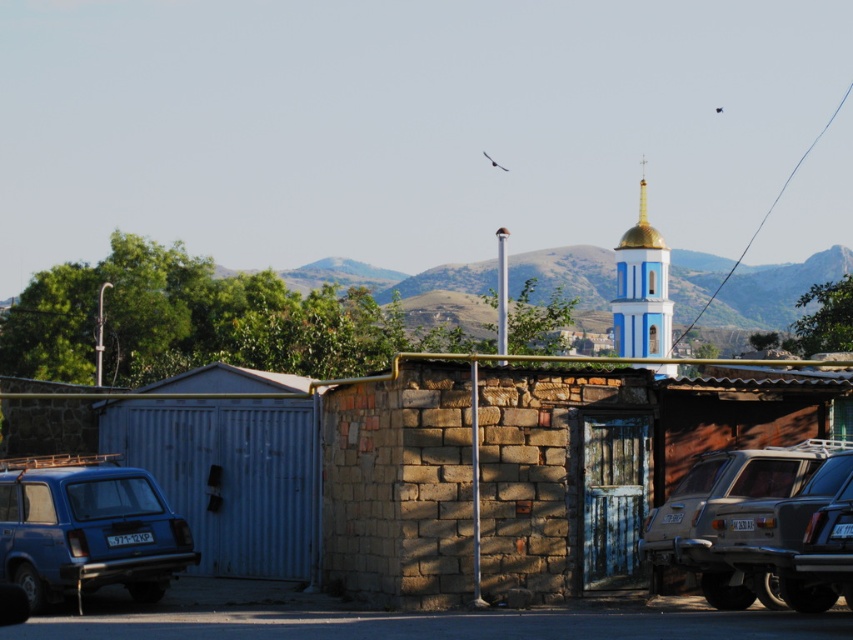
Is metallic blue shed at left to the left of matte blue suv at lower left from the viewer's perspective?

In fact, metallic blue shed at left is to the right of matte blue suv at lower left.

You are a GUI agent. You are given a task and a screenshot of the screen. Output one action in this format:
    pyautogui.click(x=<x>, y=<y>)
    Task: Click on the metallic blue shed at left
    This screenshot has height=640, width=853.
    Given the screenshot: What is the action you would take?
    pyautogui.click(x=230, y=476)

Is point (173, 518) positioned in front of point (665, 346)?

Yes.

What are the coordinates of `matte blue suv at lower left` in the screenshot? It's located at (86, 529).

Where is `matte blue suv at lower left`? This screenshot has width=853, height=640. matte blue suv at lower left is located at coordinates (86, 529).

Based on the photo, can you confirm if matte silver suv at lower right is positioned to the right of blue painted stone tower at upper right?

In fact, matte silver suv at lower right is to the left of blue painted stone tower at upper right.

Can you confirm if matte silver suv at lower right is positioned above blue painted stone tower at upper right?

No, matte silver suv at lower right is not above blue painted stone tower at upper right.

Describe the element at coordinates (723, 506) in the screenshot. The height and width of the screenshot is (640, 853). I see `matte silver suv at lower right` at that location.

The image size is (853, 640). Find the location of `matte silver suv at lower right`. matte silver suv at lower right is located at coordinates (723, 506).